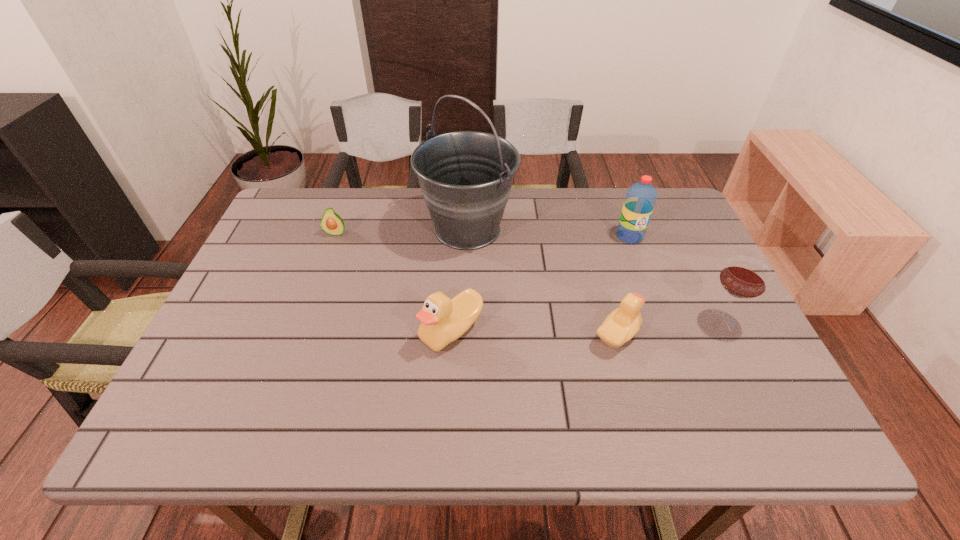
At what (x,y) coordinates should I click in order to perform the action: click on free space that satisfies the following two spatial constraints: 1. on the front label of the fifth shortest object; 2. at the beak of the fourth object from left to right. Please return your answer as a coordinate pair (x, y). This screenshot has width=960, height=540. Looking at the image, I should click on (666, 335).

You are a GUI agent. You are given a task and a screenshot of the screen. Output one action in this format:
    pyautogui.click(x=<x>, y=<y>)
    Task: Click on the free point that satisfies the following two spatial constraints: 1. on the front label of the fifth object from left to right; 2. at the beak of the fourth object from left to right
    The width and height of the screenshot is (960, 540).
    Given the screenshot: What is the action you would take?
    pyautogui.click(x=666, y=335)

I want to click on free space in the image that satisfies the following two spatial constraints: 1. on the front side of the fourth shortest object; 2. at the beak of the right duck, so click(728, 335).